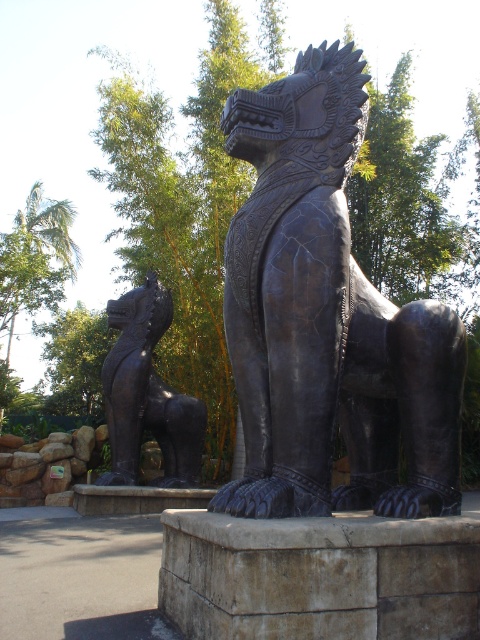
Question: Among these objects, which one is farthest from the camera?

Choices:
 (A) bronze statue at center
 (B) bronze textured lion at center

Answer: (A)

Question: Which object appears farthest from the camera in this image?

Choices:
 (A) bronze statue at center
 (B) bronze textured lion at center

Answer: (A)

Question: Can you confirm if bronze textured lion at center is positioned above bronze statue at center?

Choices:
 (A) no
 (B) yes

Answer: (B)

Question: Is bronze textured lion at center smaller than bronze statue at center?

Choices:
 (A) no
 (B) yes

Answer: (A)

Question: Does bronze textured lion at center have a larger size compared to bronze statue at center?

Choices:
 (A) yes
 (B) no

Answer: (A)